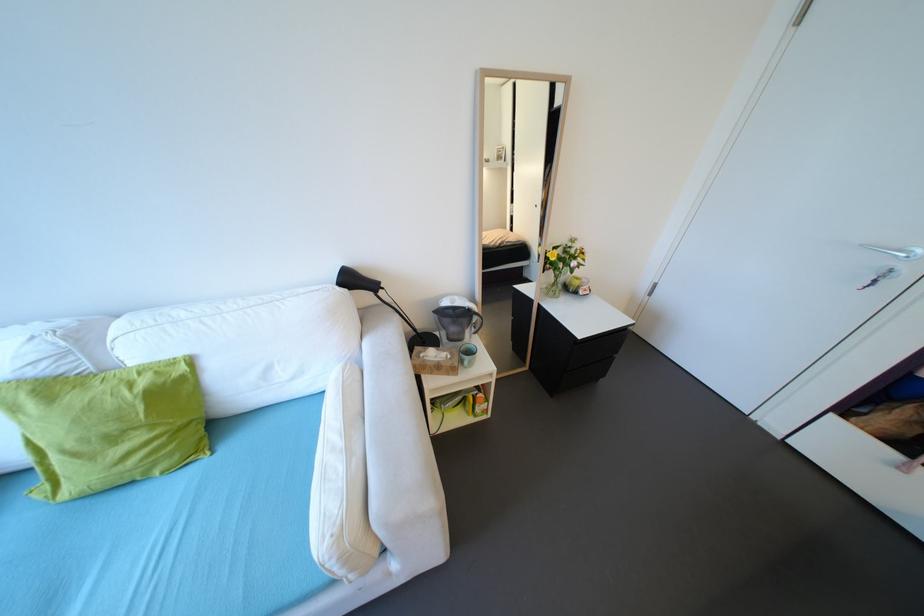
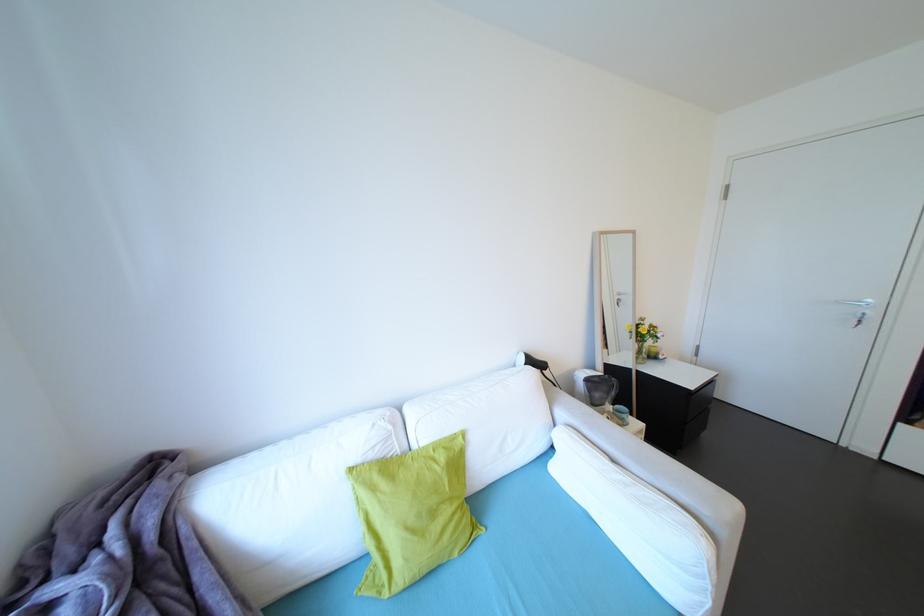
Find the pixel in the second image that matches pixel 164 475 in the first image.

(464, 556)